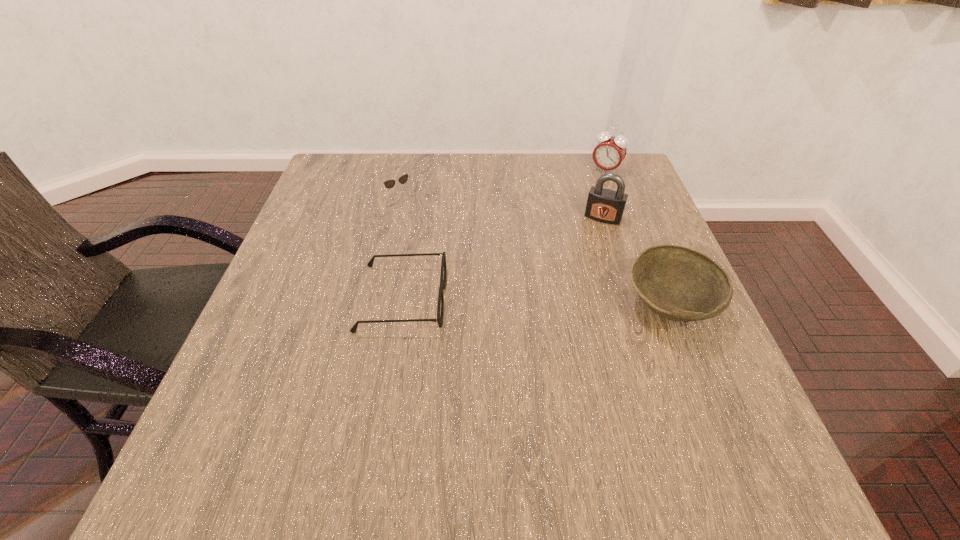
Locate an element on the screen. The image size is (960, 540). vacant space on the desktop that is between the shortest object and the bowl and is positioned in front of the lenses of the sunglasses is located at coordinates (502, 301).

Locate an element on the screen. Image resolution: width=960 pixels, height=540 pixels. free space on the desktop that is between the shortest object and the bowl and is positioned on the clock face of the farthest object is located at coordinates (516, 302).

Image resolution: width=960 pixels, height=540 pixels. What are the coordinates of `vacant space on the desktop that is between the spectacles and the bowl and is positioned on the front of the padlock near the keyhole` in the screenshot? It's located at (567, 303).